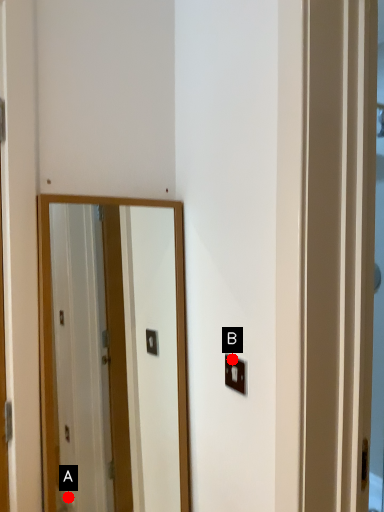
Question: Two points are circled on the image, labeled by A and B beside each circle. Which of the following is the farthest from the observer?

Choices:
 (A) A is further
 (B) B is further

Answer: (A)